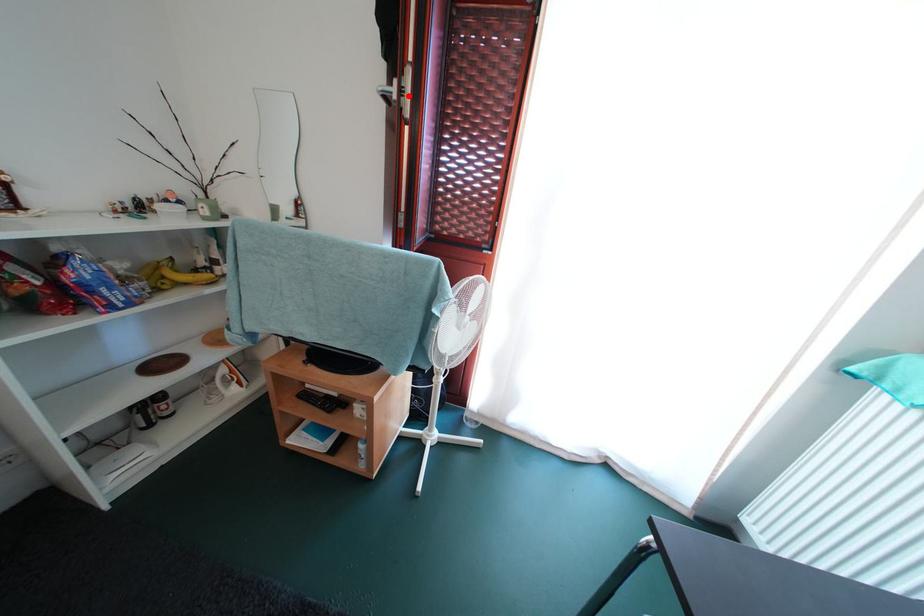
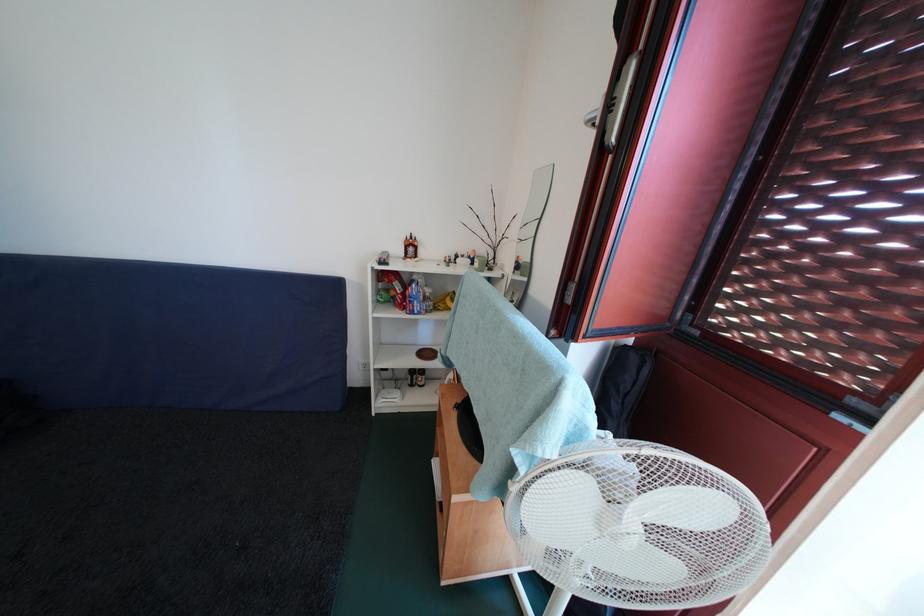
Find the pixel in the second image that matches the highlighted location in the first image.

(616, 110)